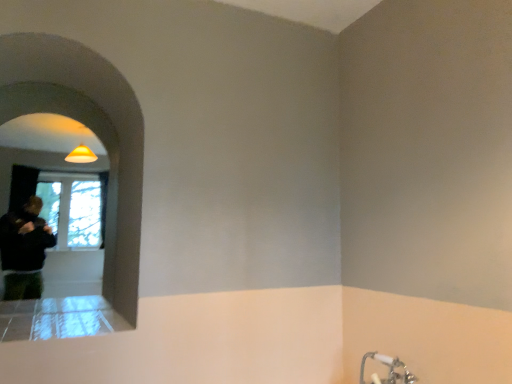
This screenshot has width=512, height=384. What do you see at coordinates (389, 370) in the screenshot?
I see `silver metallic faucet at lower right` at bounding box center [389, 370].

You are a GUI agent. You are given a task and a screenshot of the screen. Output one action in this format:
    pyautogui.click(x=<x>, y=<y>)
    Task: Click on the silver metallic faucet at lower right
    The image size is (512, 384).
    Given the screenshot: What is the action you would take?
    pyautogui.click(x=389, y=370)

This screenshot has width=512, height=384. Describe the element at coordinates (92, 130) in the screenshot. I see `white smooth archway at upper left` at that location.

Measure the distance between point (114, 212) and camera.

Point (114, 212) and camera are 7.84 feet apart.

At what (x,y) coordinates should I click in order to perform the action: click on white smooth archway at upper left. Please return your answer as a coordinate pair (x, y). Looking at the image, I should click on (92, 130).

Image resolution: width=512 pixels, height=384 pixels. I want to click on silver metallic faucet at lower right, so click(389, 370).

Based on their positions, is silver metallic faucet at lower right located to the left or right of white smooth archway at upper left?

In the image, silver metallic faucet at lower right appears on the right side of white smooth archway at upper left.

Is silver metallic faucet at lower right further to the viewer compared to white smooth archway at upper left?

Yes, silver metallic faucet at lower right is further from the camera.

Is point (365, 358) positioned behind point (125, 98)?

No.

From the image's perspective, between silver metallic faucet at lower right and white smooth archway at upper left, who is located below?

silver metallic faucet at lower right appears lower in the image.

From a real-world perspective, is silver metallic faucet at lower right positioned under white smooth archway at upper left based on gravity?

Yes, from a real-world perspective, silver metallic faucet at lower right is under white smooth archway at upper left.

Does silver metallic faucet at lower right have a greater width compared to white smooth archway at upper left?

Incorrect, the width of silver metallic faucet at lower right does not surpass that of white smooth archway at upper left.

Which of these two, silver metallic faucet at lower right or white smooth archway at upper left, stands taller?

white smooth archway at upper left.

Considering the sizes of objects silver metallic faucet at lower right and white smooth archway at upper left in the image provided, who is smaller, silver metallic faucet at lower right or white smooth archway at upper left?

With smaller size is silver metallic faucet at lower right.

Do you think silver metallic faucet at lower right is within white smooth archway at upper left, or outside of it?

silver metallic faucet at lower right is not inside white smooth archway at upper left, it's outside.

Is silver metallic faucet at lower right touching white smooth archway at upper left?

silver metallic faucet at lower right and white smooth archway at upper left are clearly separated.

Is silver metallic faucet at lower right positioned with its back to white smooth archway at upper left?

That's not correct — silver metallic faucet at lower right is not looking away from white smooth archway at upper left.

How different are the orientations of silver metallic faucet at lower right and white smooth archway at upper left in degrees?

89.3 degrees.

Measure the distance from silver metallic faucet at lower right to white smooth archway at upper left.

5.53 feet.

The width and height of the screenshot is (512, 384). Identify the location of archway positioned vertically above the silver metallic faucet at lower right (from a real-world perspective). (92, 130).

Which is more to the left, white smooth archway at upper left or silver metallic faucet at lower right?

Positioned to the left is white smooth archway at upper left.

Relative to silver metallic faucet at lower right, is white smooth archway at upper left in front or behind?

Clearly, white smooth archway at upper left is in front of silver metallic faucet at lower right.

Does point (113, 176) come closer to viewer compared to point (407, 370)?

No, it is not.

From the image's perspective, is white smooth archway at upper left on silver metallic faucet at lower right?

Yes.

From a real-world perspective, is white smooth archway at upper left physically above silver metallic faucet at lower right?

Yes.

Looking at their sizes, would you say white smooth archway at upper left is wider or thinner than silver metallic faucet at lower right?

Clearly, white smooth archway at upper left has more width compared to silver metallic faucet at lower right.

Which of these two, white smooth archway at upper left or silver metallic faucet at lower right, stands taller?

Standing taller between the two is white smooth archway at upper left.

Can you confirm if white smooth archway at upper left is bigger than silver metallic faucet at lower right?

Indeed, white smooth archway at upper left has a larger size compared to silver metallic faucet at lower right.

Consider the image. Is white smooth archway at upper left inside the boundaries of silver metallic faucet at lower right, or outside?

white smooth archway at upper left is located beyond the bounds of silver metallic faucet at lower right.

Is white smooth archway at upper left in contact with silver metallic faucet at lower right?

white smooth archway at upper left is not next to silver metallic faucet at lower right, and they're not touching.

Could you tell me if white smooth archway at upper left is facing silver metallic faucet at lower right?

No.

Consider the image. Can you tell me how much white smooth archway at upper left and silver metallic faucet at lower right differ in facing direction?

89.3 degrees separate the facing orientations of white smooth archway at upper left and silver metallic faucet at lower right.

How distant is white smooth archway at upper left from silver metallic faucet at lower right?

Answer: They are 5.53 feet apart.

The height and width of the screenshot is (384, 512). In the image, there is a silver metallic faucet at lower right. Identify the location of archway above it (from the image's perspective). (92, 130).

Locate an element on the screen. tap lying behind the white smooth archway at upper left is located at coordinates [x=389, y=370].

The image size is (512, 384). Identify the location of archway located above the silver metallic faucet at lower right (from a real-world perspective). (92, 130).